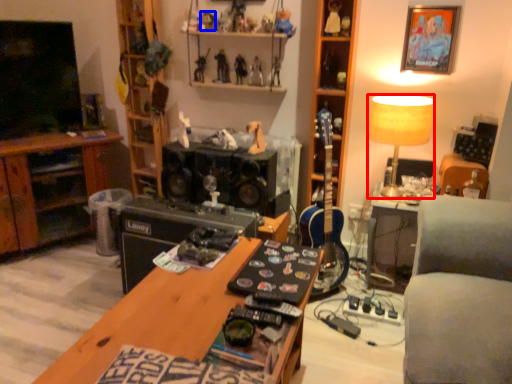
Question: Which point is closer to the camera, lamp (highlighted by a red box) or toy (highlighted by a blue box)?

Choices:
 (A) lamp
 (B) toy

Answer: (A)